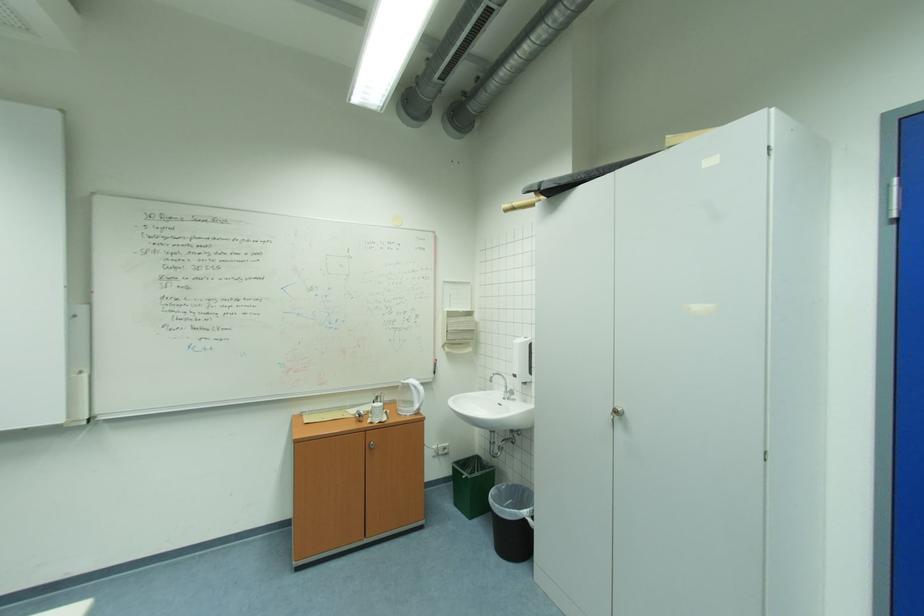
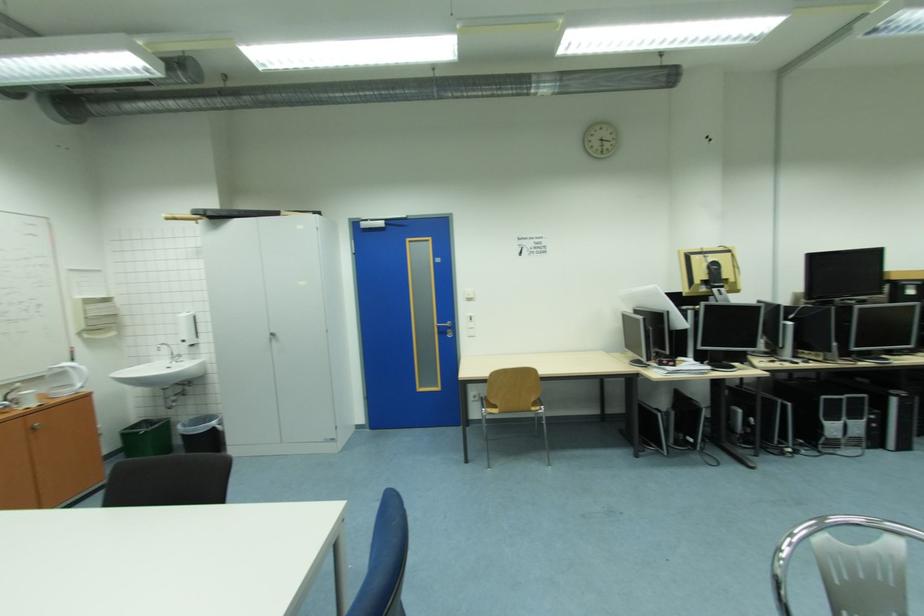
Where in the second image is the point corresponding to point 458,315 from the first image?

(94, 302)